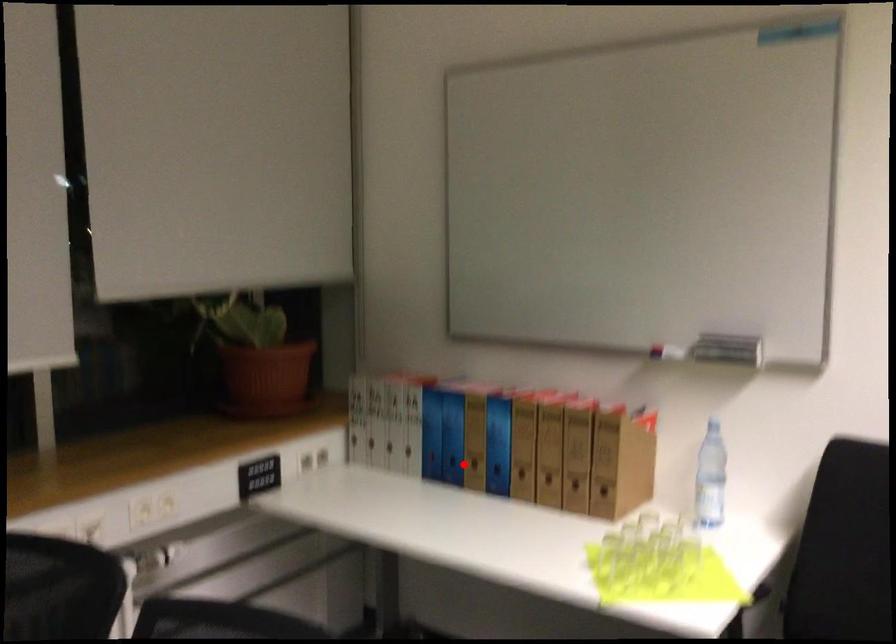
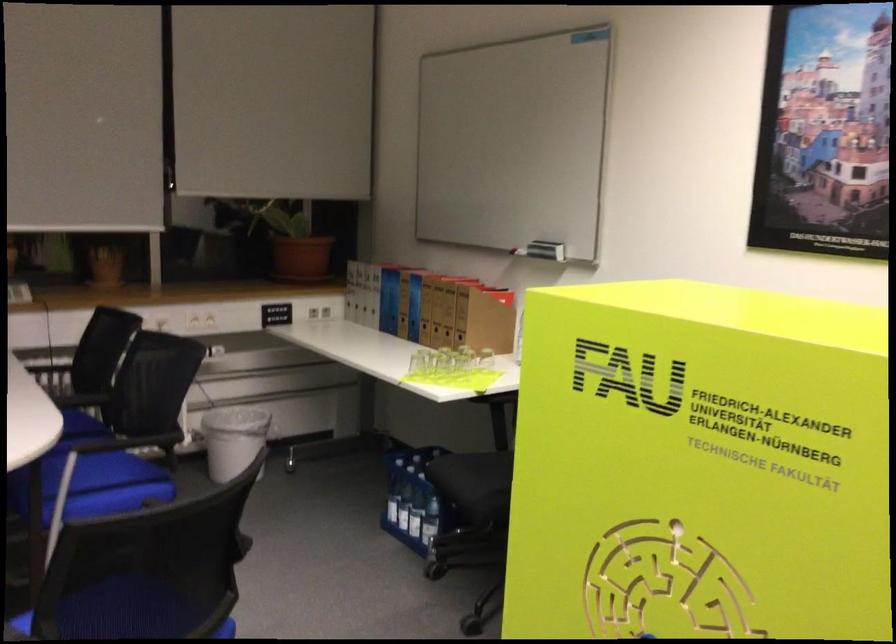
Find the pixel in the second image that matches the highlighted location in the first image.

(398, 317)